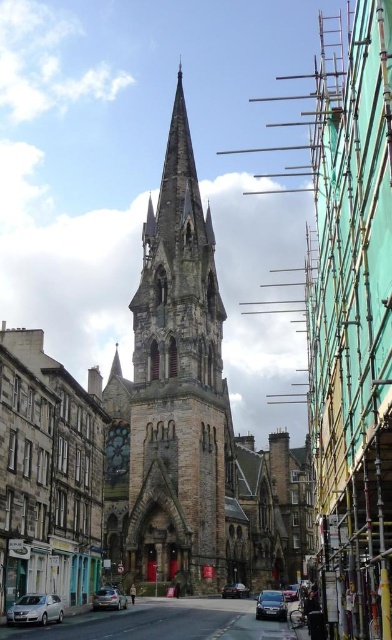
Does shiny silver sedan at center have a greater width compared to shiny black sedan at center?

Incorrect, shiny silver sedan at center's width does not surpass shiny black sedan at center's.

Is point (274, 604) in front of point (241, 588)?

Yes, it is in front of point (241, 588).

Locate an element on the screen. This screenshot has height=640, width=392. shiny silver sedan at center is located at coordinates (270, 605).

From the picture: Between satin silver sedan at lower left and metallic silver car at center, which one is positioned lower?

metallic silver car at center

Is satin silver sedan at lower left further to camera compared to metallic silver car at center?

No, satin silver sedan at lower left is closer to the viewer.

Who is more forward, (47,616) or (286,595)?

Point (47,616)

This screenshot has width=392, height=640. What are the coordinates of `satin silver sedan at lower left` in the screenshot? It's located at (36, 609).

In the scene shown: Can you confirm if shiny silver sedan at center is positioned to the right of metallic silver car at lower left?

Yes, shiny silver sedan at center is to the right of metallic silver car at lower left.

Can you confirm if shiny silver sedan at center is bigger than metallic silver car at lower left?

Indeed, shiny silver sedan at center has a larger size compared to metallic silver car at lower left.

Image resolution: width=392 pixels, height=640 pixels. What do you see at coordinates (270, 605) in the screenshot? I see `shiny silver sedan at center` at bounding box center [270, 605].

The width and height of the screenshot is (392, 640). I want to click on shiny silver sedan at center, so click(270, 605).